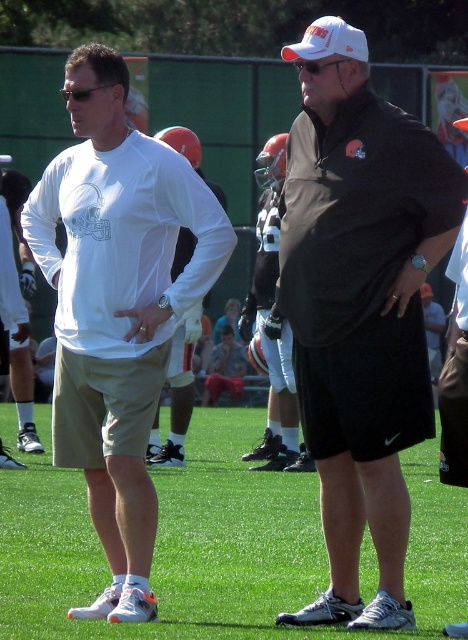
Between matte black shirt at center and green grass at center, which one has more height?

With more height is matte black shirt at center.

Between matte black shirt at center and green grass at center, which one is positioned higher?

matte black shirt at center is above.

Between point (356, 84) and point (28, 609), which one is positioned behind?

The point (356, 84) is more distant.

Where is `matte black shirt at center`? matte black shirt at center is located at coordinates (359, 307).

Identify the location of green grass at center. Image resolution: width=468 pixels, height=640 pixels. (214, 545).

Does green grass at center appear over white matte long-sleeve shirt at left?

Incorrect, green grass at center is not positioned above white matte long-sleeve shirt at left.

Identify the location of green grass at center. The width and height of the screenshot is (468, 640). pos(214,545).

Which is above, white matte long-sleeve shirt at left or matte white shirt at center?

Positioned higher is white matte long-sleeve shirt at left.

Is white matte long-sleeve shirt at left closer to camera compared to matte white shirt at center?

Yes, it is.

Does point (100, 401) lie in front of point (175, 125)?

Yes, point (100, 401) is closer to viewer.

Find the location of `white matte long-sleeve shirt at left`. white matte long-sleeve shirt at left is located at coordinates (117, 307).